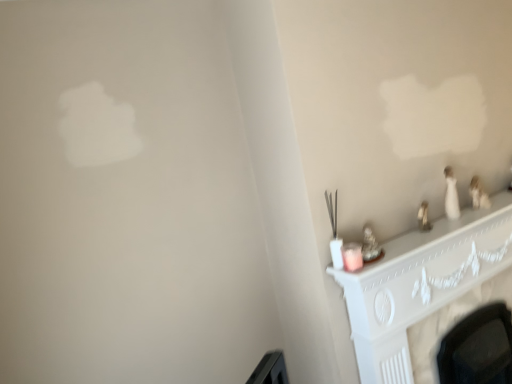
Where is `matte white candle at right`? The height and width of the screenshot is (384, 512). matte white candle at right is located at coordinates (352, 256).

What do you see at coordinates (352, 256) in the screenshot? I see `matte white candle at right` at bounding box center [352, 256].

This screenshot has width=512, height=384. What do you see at coordinates (420, 284) in the screenshot? I see `white carved fireplace at lower right` at bounding box center [420, 284].

This screenshot has width=512, height=384. In order to click on white carved fireplace at lower right in this screenshot , I will do `click(420, 284)`.

Identify the location of matte white candle at right. (352, 256).

Considering the positions of objects white carved fireplace at lower right and matte white candle at right in the image provided, who is more to the left, white carved fireplace at lower right or matte white candle at right?

Positioned to the left is matte white candle at right.

Considering the positions of objects white carved fireplace at lower right and matte white candle at right in the image provided, who is in front, white carved fireplace at lower right or matte white candle at right?

matte white candle at right.

Considering the points (392, 242) and (348, 270), which point is in front, point (392, 242) or point (348, 270)?

The point (348, 270) is in front.

From the image's perspective, is white carved fireplace at lower right beneath matte white candle at right?

Indeed, from the image's perspective, white carved fireplace at lower right is shown beneath matte white candle at right.

From a real-world perspective, relative to matte white candle at right, is white carved fireplace at lower right vertically above or below?

From a real-world perspective, white carved fireplace at lower right is physically below matte white candle at right.

Considering the relative sizes of white carved fireplace at lower right and matte white candle at right in the image provided, is white carved fireplace at lower right thinner than matte white candle at right?

No, white carved fireplace at lower right is not thinner than matte white candle at right.

Considering the relative sizes of white carved fireplace at lower right and matte white candle at right in the image provided, is white carved fireplace at lower right taller than matte white candle at right?

Yes.

Can you confirm if white carved fireplace at lower right is bigger than matte white candle at right?

Indeed, white carved fireplace at lower right has a larger size compared to matte white candle at right.

Do you think white carved fireplace at lower right is within matte white candle at right, or outside of it?

white carved fireplace at lower right cannot be found inside matte white candle at right.

Is white carved fireplace at lower right placed right next to matte white candle at right?

white carved fireplace at lower right and matte white candle at right are clearly separated.

Is white carved fireplace at lower right oriented towards matte white candle at right?

No, white carved fireplace at lower right is not turned towards matte white candle at right.

Can you tell me how much white carved fireplace at lower right and matte white candle at right differ in facing direction?

The facing directions of white carved fireplace at lower right and matte white candle at right are 2.65 degrees apart.

This screenshot has width=512, height=384. Identify the location of fireplace lying on the right of matte white candle at right. (420, 284).

Considering the relative positions of matte white candle at right and white carved fireplace at lower right in the image provided, is matte white candle at right to the right of white carved fireplace at lower right from the viewer's perspective?

No.

Relative to white carved fireplace at lower right, is matte white candle at right in front or behind?

Visually, matte white candle at right is located in front of white carved fireplace at lower right.

Does point (352, 253) appear closer or farther from the camera than point (442, 263)?

Point (352, 253) is positioned closer to the camera compared to point (442, 263).

From the image's perspective, is matte white candle at right over white carved fireplace at lower right?

Yes, from the image's perspective, matte white candle at right is on top of white carved fireplace at lower right.

From a real-world perspective, is matte white candle at right under white carved fireplace at lower right?

Actually, matte white candle at right is physically above white carved fireplace at lower right in the real world.

Which object is thinner, matte white candle at right or white carved fireplace at lower right?

matte white candle at right.

Considering the relative sizes of matte white candle at right and white carved fireplace at lower right in the image provided, is matte white candle at right taller than white carved fireplace at lower right?

No, matte white candle at right is not taller than white carved fireplace at lower right.

Between matte white candle at right and white carved fireplace at lower right, which one has larger size?

Bigger between the two is white carved fireplace at lower right.

Do you think matte white candle at right is within white carved fireplace at lower right, or outside of it?

matte white candle at right is not inside white carved fireplace at lower right, it's outside.

Is matte white candle at right directly adjacent to white carved fireplace at lower right?

matte white candle at right and white carved fireplace at lower right are clearly separated.

Is matte white candle at right turned away from white carved fireplace at lower right?

No, matte white candle at right is not facing the opposite direction of white carved fireplace at lower right.

What's the angular difference between matte white candle at right and white carved fireplace at lower right's facing directions?

The angle between the facing direction of matte white candle at right and the facing direction of white carved fireplace at lower right is 2.65 degrees.

Measure the distance from matte white candle at right to white carved fireplace at lower right.

A distance of 16.18 inches exists between matte white candle at right and white carved fireplace at lower right.

You are a GUI agent. You are given a task and a screenshot of the screen. Output one action in this format:
    pyautogui.click(x=<x>, y=<y>)
    Task: Click on the candle holder above the white carved fireplace at lower right (from a real-world perspective)
    The height and width of the screenshot is (384, 512).
    Given the screenshot: What is the action you would take?
    pyautogui.click(x=352, y=256)

Where is `fireplace lying on the right of matte white candle at right`? fireplace lying on the right of matte white candle at right is located at coordinates (420, 284).

Find the location of a particular element. Image resolution: width=512 pixels, height=384 pixels. fireplace that appears behind the matte white candle at right is located at coordinates pyautogui.click(x=420, y=284).